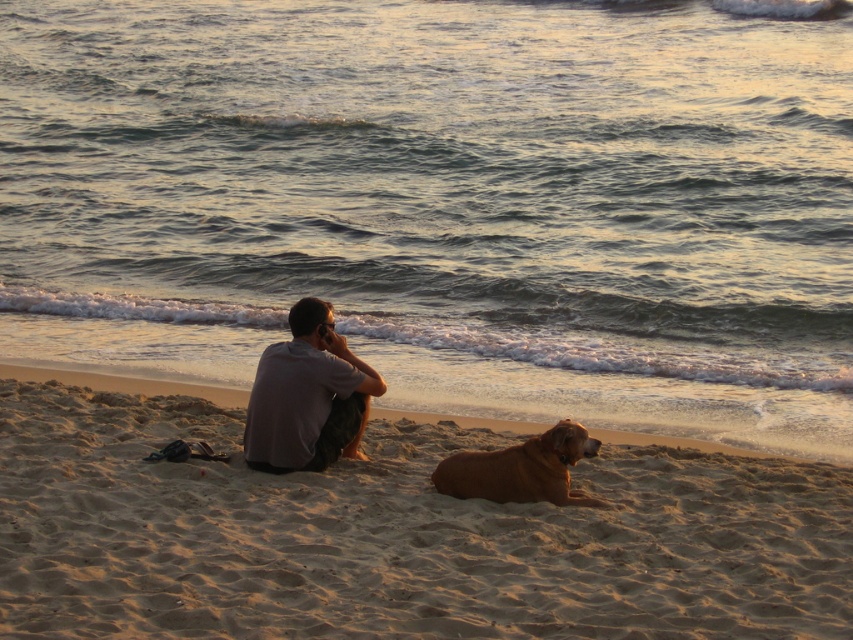
Does sandy yellow sand at center come behind golden fur dog at lower center?

No, it is not.

Does sandy yellow sand at center have a larger size compared to golden fur dog at lower center?

Correct, sandy yellow sand at center is larger in size than golden fur dog at lower center.

Between point (160, 632) and point (473, 456), which one is positioned in front?

Point (160, 632) is in front.

Find the location of a particular element. Image resolution: width=853 pixels, height=640 pixels. sandy yellow sand at center is located at coordinates (395, 536).

Which of these two, light gray cotton shirt at center or sandy shore at lower center, stands shorter?

sandy shore at lower center

Is light gray cotton shirt at center smaller than sandy shore at lower center?

Incorrect, light gray cotton shirt at center is not smaller in size than sandy shore at lower center.

Is point (311, 381) positioned behind point (664, 442)?

That is False.

Find the location of a particular element. light gray cotton shirt at center is located at coordinates (x=306, y=396).

The image size is (853, 640). What do you see at coordinates (395, 536) in the screenshot? I see `sandy yellow sand at center` at bounding box center [395, 536].

Can you confirm if sandy yellow sand at center is wider than sandy shore at lower center?

Correct, the width of sandy yellow sand at center exceeds that of sandy shore at lower center.

Based on the photo, who is more forward, (434, 634) or (9, 374)?

Point (434, 634) is more forward.

The image size is (853, 640). In order to click on sandy yellow sand at center in this screenshot , I will do `click(395, 536)`.